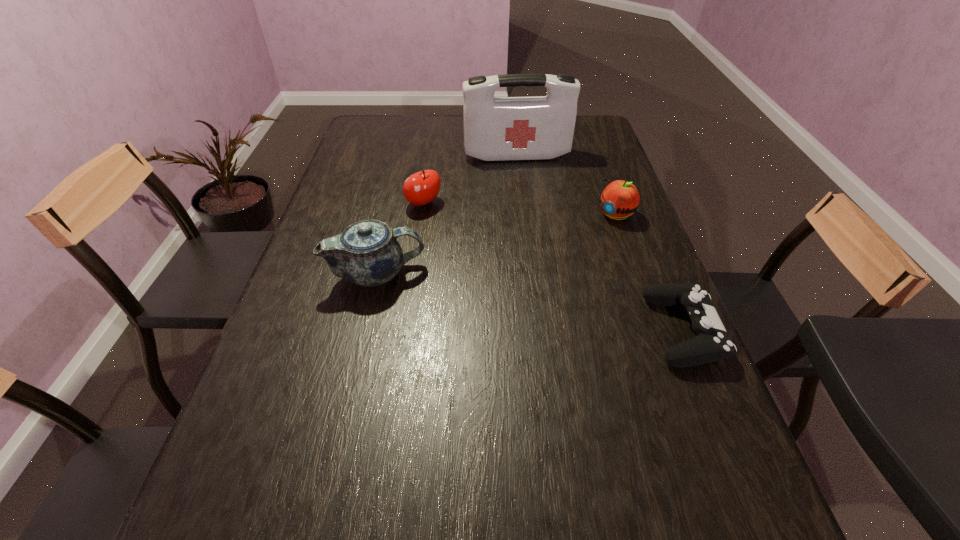
Identify the location of vacant region located on the surface of the right apple. (x=584, y=237).

I want to click on free space located 0.160m on the surface of the right apple, so click(567, 248).

Where is `vacant region located on the surface of the right apple`? The image size is (960, 540). vacant region located on the surface of the right apple is located at coordinates click(x=514, y=288).

What are the coordinates of `free space located 0.150m on the front side of the first-aid kit` in the screenshot? It's located at coord(526,188).

Where is `free space located on the front side of the first-aid kit`? The image size is (960, 540). free space located on the front side of the first-aid kit is located at coordinates (522, 171).

Locate an element on the screen. free region located on the front side of the first-aid kit is located at coordinates [x=539, y=240].

Find the location of a particular element. This screenshot has height=540, width=960. object located at the left edge is located at coordinates (367, 253).

The image size is (960, 540). What are the coordinates of `control that is at the right edge` in the screenshot? It's located at (712, 343).

The width and height of the screenshot is (960, 540). In order to click on apple present at the right edge in this screenshot , I will do `click(620, 199)`.

I want to click on the first-aid kit that is positioned at the right edge, so click(x=538, y=127).